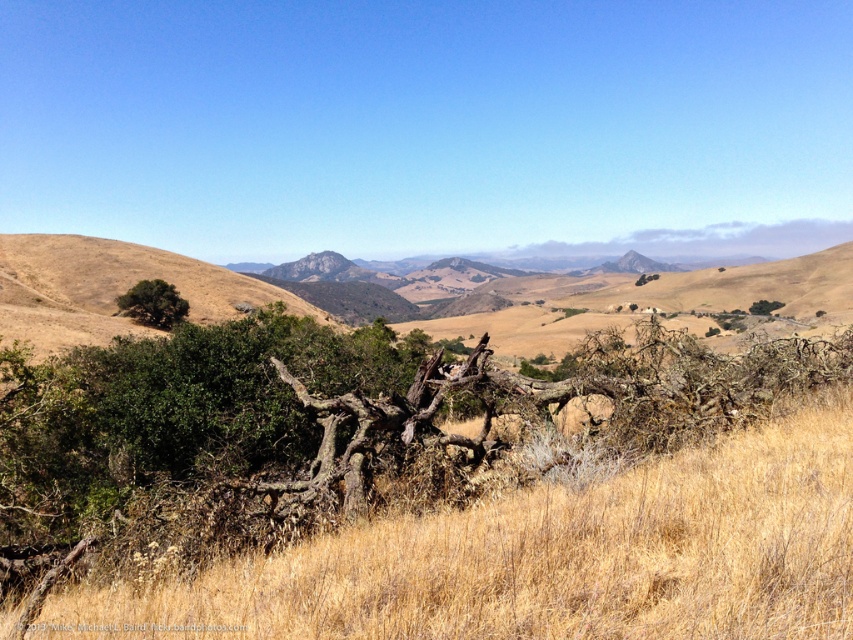
You are standing at the camera position and want to reach the point marked at coordinates (164, 291). Given that your walking speed is 1.5 meters per second, how many seconds will it take you to reach that point?

The distance between you and the point marked at coordinates (164, 291) is 109.71 meters. At a walking speed of 1.5 meters per second, it will take approximately 73.14 seconds to reach the point.